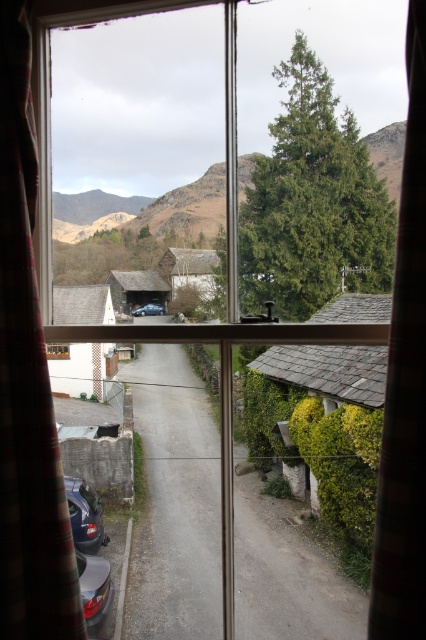
You are standing in a room looking through the window. You see a green textured tree at upper right and a metallic blue car at center. Which object is closer to you?

The green textured tree at upper right is closer to you because it is in front of the metallic blue car at center.

You are an interior designer assessing the window space. The plaid fabric curtain at left and the metallic blue car at lower left are both visible through the window. Which object takes up more area in the window frame?

The metallic blue car at lower left takes up more area in the window frame than the plaid fabric curtain at left, as the plaid fabric curtain at left occupies less space than metallic blue car at lower left.